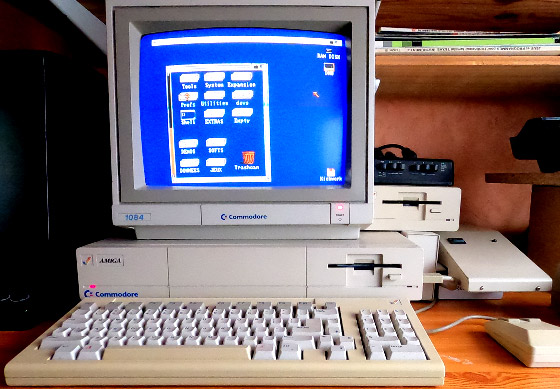
Locate an element on the screen. monitor is located at coordinates (358, 79).